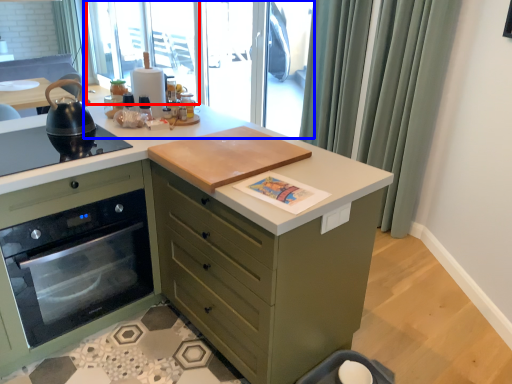
Question: Which of the following is the farthest to the observer, window screen (highlighted by a red box) or window screen (highlighted by a blue box)?

Choices:
 (A) window screen
 (B) window screen

Answer: (A)